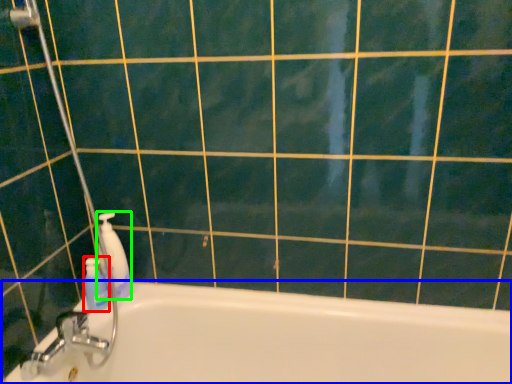
Question: Estimate the real-world distances between objects in this image. Which object is closer to cleaning product (highlighted by a red box), bathtub (highlighted by a blue box) or cleaning product (highlighted by a green box)?

Choices:
 (A) bathtub
 (B) cleaning product

Answer: (B)